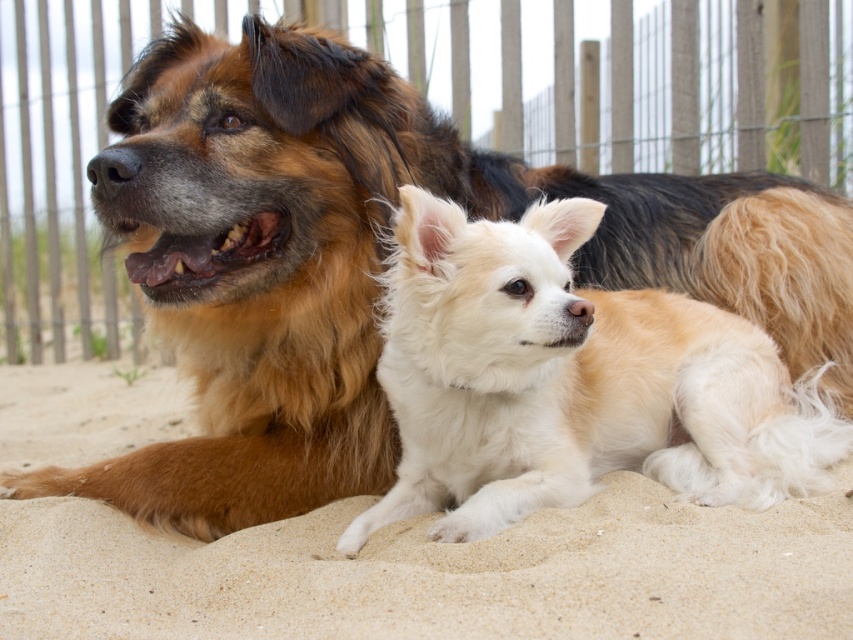
Is fluffy white dog at center shorter than wooden fence at upper center?

Incorrect, fluffy white dog at center's height does not fall short of wooden fence at upper center's.

Does fluffy white dog at center appear over wooden fence at upper center?

Incorrect, fluffy white dog at center is not positioned above wooden fence at upper center.

Who is more forward, [433,396] or [637,74]?

Point [433,396] is in front.

The width and height of the screenshot is (853, 640). Find the location of `fluffy white dog at center`. fluffy white dog at center is located at coordinates (572, 380).

Who is more forward, (125, 604) or (436, 294)?

Positioned in front is point (436, 294).

Does fine-grained sand at lower center appear under fluffy white dog at center?

Yes.

Between point (373, 621) and point (416, 429), which one is positioned behind?

The point (416, 429) is more distant.

Where is `fine-grained sand at lower center`? fine-grained sand at lower center is located at coordinates (436, 573).

From the picture: Does fine-grained sand at lower center appear over wooden fence at upper center?

Actually, fine-grained sand at lower center is below wooden fence at upper center.

Does fine-grained sand at lower center appear on the left side of wooden fence at upper center?

Yes, fine-grained sand at lower center is to the left of wooden fence at upper center.

Who is more distant from viewer, (x=624, y=589) or (x=15, y=120)?

The point (x=15, y=120) is behind.

Locate an element on the screen. This screenshot has width=853, height=640. fine-grained sand at lower center is located at coordinates (436, 573).